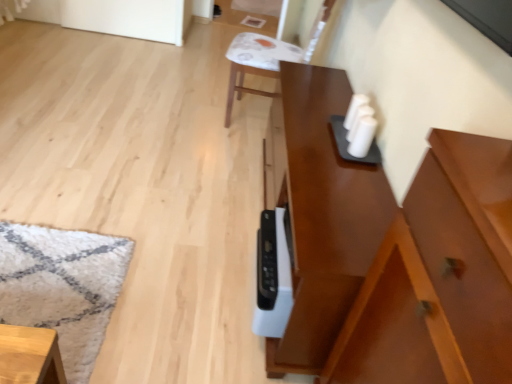
Locate an element on the screen. The height and width of the screenshot is (384, 512). vacant location below white fabric chair at upper center (from a real-world perspective) is located at coordinates (245, 111).